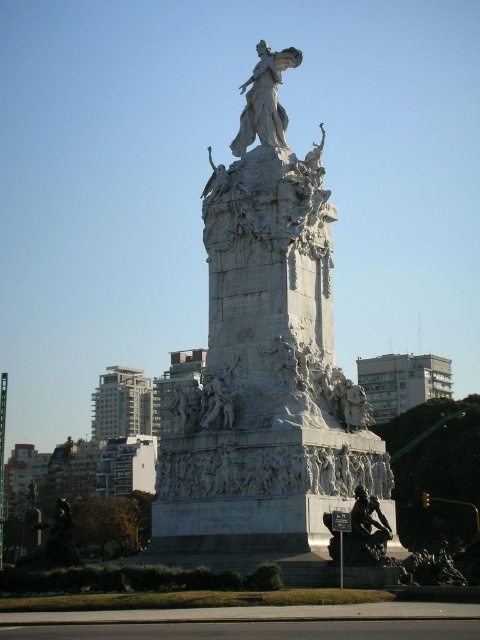
You are an urban planner assessing the space around the white marble monument at center and the white marble statue at center. Which object is wider?

The white marble monument at center is wider than the white marble statue at center.

You are a tour guide explaining the layout of the monument to visitors. Pointing to the white marble monument at center and the white marble statue at center, you want to clarify their positions. Which one is located to the right side?

The white marble monument at center is to the right of the white marble statue at center.